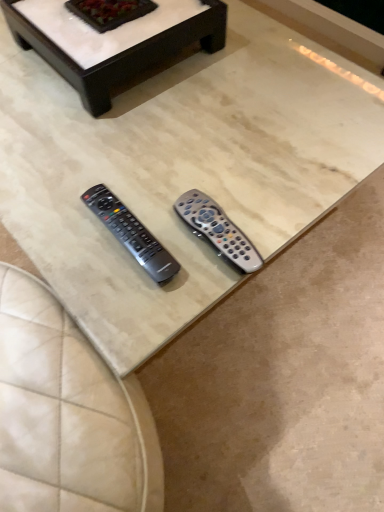
What do you see at coordinates (131, 234) in the screenshot? This screenshot has width=384, height=512. I see `silver metallic remote at center, which is counted as the first remote control, starting from the left` at bounding box center [131, 234].

What do you see at coordinates (179, 169) in the screenshot? The width and height of the screenshot is (384, 512). I see `beige marble coffee table at center, the first coffee table in the front-to-back sequence` at bounding box center [179, 169].

Where is `white marble coffee table at upper center, which ranks as the first coffee table in back-to-front order`? white marble coffee table at upper center, which ranks as the first coffee table in back-to-front order is located at coordinates (120, 51).

Considering the relative sizes of white marble coffee table at upper center, which appears as the second coffee table when viewed from the front, and silver metallic remote at center, which is counted as the first remote control, starting from the left, in the image provided, is white marble coffee table at upper center, which appears as the second coffee table when viewed from the front, bigger than silver metallic remote at center, which is counted as the first remote control, starting from the left,?

Correct, white marble coffee table at upper center, which appears as the second coffee table when viewed from the front, is larger in size than silver metallic remote at center, which is counted as the first remote control, starting from the left.

Does white marble coffee table at upper center, which appears as the second coffee table when viewed from the front, lie in front of silver metallic remote at center, which is counted as the first remote control, starting from the left?

No, the depth of white marble coffee table at upper center, which appears as the second coffee table when viewed from the front, is greater than that of silver metallic remote at center, which is counted as the first remote control, starting from the left.

From a real-world perspective, is white marble coffee table at upper center, which appears as the second coffee table when viewed from the front, above or below silver metallic remote at center, which ranks as the second remote control in right-to-left order?

Clearly, from a real-world perspective, white marble coffee table at upper center, which appears as the second coffee table when viewed from the front, is above silver metallic remote at center, which ranks as the second remote control in right-to-left order.

Is the position of translucent gray remote at center, arranged as the 1th remote control when viewed from the right, less distant than that of silver metallic remote at center, which ranks as the second remote control in right-to-left order?

That is False.

Is translucent gray remote at center, positioned as the 2th remote control in left-to-right order, not near silver metallic remote at center, which ranks as the second remote control in right-to-left order?

No, there isn't a large distance between translucent gray remote at center, positioned as the 2th remote control in left-to-right order, and silver metallic remote at center, which ranks as the second remote control in right-to-left order.

From a real-world perspective, which object rests below the other?

translucent gray remote at center, positioned as the 2th remote control in left-to-right order, is physically lower.

Is point (180, 83) positioned in front of point (163, 49)?

Yes, point (180, 83) is in front of point (163, 49).

Between beige marble coffee table at center, the first coffee table in the front-to-back sequence, and white marble coffee table at upper center, which ranks as the first coffee table in back-to-front order, which one has less height?

white marble coffee table at upper center, which ranks as the first coffee table in back-to-front order, is shorter.

Can you confirm if beige marble coffee table at center, the first coffee table in the front-to-back sequence, is thinner than white marble coffee table at upper center, which appears as the second coffee table when viewed from the front?

No, beige marble coffee table at center, the first coffee table in the front-to-back sequence, is not thinner than white marble coffee table at upper center, which appears as the second coffee table when viewed from the front.

How distant is beige marble coffee table at center, acting as the 2th coffee table starting from the back, from white marble coffee table at upper center, which ranks as the first coffee table in back-to-front order?

A distance of 7.04 inches exists between beige marble coffee table at center, acting as the 2th coffee table starting from the back, and white marble coffee table at upper center, which ranks as the first coffee table in back-to-front order.

Does translucent gray remote at center, positioned as the 2th remote control in left-to-right order, come behind white marble coffee table at upper center, which appears as the second coffee table when viewed from the front?

No, it is in front of white marble coffee table at upper center, which appears as the second coffee table when viewed from the front.

Measure the distance from translucent gray remote at center, positioned as the 2th remote control in left-to-right order, to white marble coffee table at upper center, which ranks as the first coffee table in back-to-front order.

They are 16.11 inches apart.

Which is farther from the camera, (249,246) or (81,89)?

The point (81,89) is farther.

Based on their positions, is translucent gray remote at center, arranged as the 1th remote control when viewed from the right, located to the left or right of white marble coffee table at upper center, which appears as the second coffee table when viewed from the front?

Clearly, translucent gray remote at center, arranged as the 1th remote control when viewed from the right, is on the right of white marble coffee table at upper center, which appears as the second coffee table when viewed from the front, in the image.

Is translucent gray remote at center, positioned as the 2th remote control in left-to-right order, not close to beige marble coffee table at center, the first coffee table in the front-to-back sequence?

No.

Does translucent gray remote at center, positioned as the 2th remote control in left-to-right order, have a greater width compared to beige marble coffee table at center, the first coffee table in the front-to-back sequence?

Incorrect, the width of translucent gray remote at center, positioned as the 2th remote control in left-to-right order, does not surpass that of beige marble coffee table at center, the first coffee table in the front-to-back sequence.

Is point (177, 205) closer or farther from the camera than point (52, 270)?

Point (177, 205) is positioned farther from the camera compared to point (52, 270).

Is translucent gray remote at center, positioned as the 2th remote control in left-to-right order, situated inside beige marble coffee table at center, the first coffee table in the front-to-back sequence, or outside?

translucent gray remote at center, positioned as the 2th remote control in left-to-right order, fits inside beige marble coffee table at center, the first coffee table in the front-to-back sequence.

Considering the relative sizes of white marble coffee table at upper center, which ranks as the first coffee table in back-to-front order, and beige marble coffee table at center, acting as the 2th coffee table starting from the back, in the image provided, is white marble coffee table at upper center, which ranks as the first coffee table in back-to-front order, thinner than beige marble coffee table at center, acting as the 2th coffee table starting from the back,?

Correct, the width of white marble coffee table at upper center, which ranks as the first coffee table in back-to-front order, is less than that of beige marble coffee table at center, acting as the 2th coffee table starting from the back.

The width and height of the screenshot is (384, 512). Find the location of `coffee table on the left of white marble coffee table at upper center, which ranks as the first coffee table in back-to-front order`. coffee table on the left of white marble coffee table at upper center, which ranks as the first coffee table in back-to-front order is located at coordinates (179, 169).

Which is in front, white marble coffee table at upper center, which appears as the second coffee table when viewed from the front, or beige marble coffee table at center, acting as the 2th coffee table starting from the back?

beige marble coffee table at center, acting as the 2th coffee table starting from the back, is closer to the camera.

Is point (70, 59) closer to camera compared to point (316, 197)?

No, it is behind (316, 197).

Would you say silver metallic remote at center, which ranks as the second remote control in right-to-left order, is inside or outside translucent gray remote at center, arranged as the 1th remote control when viewed from the right?

silver metallic remote at center, which ranks as the second remote control in right-to-left order, is spatially situated outside translucent gray remote at center, arranged as the 1th remote control when viewed from the right.

Who is bigger, silver metallic remote at center, which is counted as the first remote control, starting from the left, or translucent gray remote at center, arranged as the 1th remote control when viewed from the right?

Bigger between the two is translucent gray remote at center, arranged as the 1th remote control when viewed from the right.

Is silver metallic remote at center, which ranks as the second remote control in right-to-left order, turned away from translucent gray remote at center, arranged as the 1th remote control when viewed from the right?

Yes, silver metallic remote at center, which ranks as the second remote control in right-to-left order, is facing away from translucent gray remote at center, arranged as the 1th remote control when viewed from the right.

Does silver metallic remote at center, which ranks as the second remote control in right-to-left order, have a greater height compared to translucent gray remote at center, positioned as the 2th remote control in left-to-right order?

In fact, silver metallic remote at center, which ranks as the second remote control in right-to-left order, may be shorter than translucent gray remote at center, positioned as the 2th remote control in left-to-right order.

Locate an element on the screen. the 2nd remote control in front of the white marble coffee table at upper center, which ranks as the first coffee table in back-to-front order is located at coordinates (131, 234).

Locate an element on the screen. The height and width of the screenshot is (512, 384). remote control behind the silver metallic remote at center, which ranks as the second remote control in right-to-left order is located at coordinates (218, 230).

Looking at the image, which one is located closer to translucent gray remote at center, positioned as the 2th remote control in left-to-right order, white marble coffee table at upper center, which ranks as the first coffee table in back-to-front order, or silver metallic remote at center, which ranks as the second remote control in right-to-left order?

Among the two, silver metallic remote at center, which ranks as the second remote control in right-to-left order, is located nearer to translucent gray remote at center, positioned as the 2th remote control in left-to-right order.

From the image, which object appears to be farther from silver metallic remote at center, which is counted as the first remote control, starting from the left, beige marble coffee table at center, the first coffee table in the front-to-back sequence, or white marble coffee table at upper center, which ranks as the first coffee table in back-to-front order?

white marble coffee table at upper center, which ranks as the first coffee table in back-to-front order, is further to silver metallic remote at center, which is counted as the first remote control, starting from the left.

Considering their positions, is translucent gray remote at center, arranged as the 1th remote control when viewed from the right, positioned closer to silver metallic remote at center, which ranks as the second remote control in right-to-left order, than white marble coffee table at upper center, which appears as the second coffee table when viewed from the front?

The object closer to silver metallic remote at center, which ranks as the second remote control in right-to-left order, is translucent gray remote at center, arranged as the 1th remote control when viewed from the right.

Looking at the image, which one is located further to beige marble coffee table at center, acting as the 2th coffee table starting from the back, translucent gray remote at center, arranged as the 1th remote control when viewed from the right, or silver metallic remote at center, which ranks as the second remote control in right-to-left order?

Among the two, silver metallic remote at center, which ranks as the second remote control in right-to-left order, is located further to beige marble coffee table at center, acting as the 2th coffee table starting from the back.

Considering their positions, is silver metallic remote at center, which ranks as the second remote control in right-to-left order, positioned further to translucent gray remote at center, positioned as the 2th remote control in left-to-right order, than white marble coffee table at upper center, which ranks as the first coffee table in back-to-front order?

white marble coffee table at upper center, which ranks as the first coffee table in back-to-front order, is positioned further to the anchor translucent gray remote at center, positioned as the 2th remote control in left-to-right order.

Which object lies nearer to the anchor point beige marble coffee table at center, acting as the 2th coffee table starting from the back, silver metallic remote at center, which ranks as the second remote control in right-to-left order, or translucent gray remote at center, arranged as the 1th remote control when viewed from the right?

translucent gray remote at center, arranged as the 1th remote control when viewed from the right.

Estimate the real-world distances between objects in this image. Which object is further from white marble coffee table at upper center, which ranks as the first coffee table in back-to-front order, translucent gray remote at center, arranged as the 1th remote control when viewed from the right, or beige marble coffee table at center, the first coffee table in the front-to-back sequence?

translucent gray remote at center, arranged as the 1th remote control when viewed from the right, is further to white marble coffee table at upper center, which ranks as the first coffee table in back-to-front order.

Based on their spatial positions, is white marble coffee table at upper center, which ranks as the first coffee table in back-to-front order, or translucent gray remote at center, positioned as the 2th remote control in left-to-right order, further from silver metallic remote at center, which ranks as the second remote control in right-to-left order?

Based on the image, white marble coffee table at upper center, which ranks as the first coffee table in back-to-front order, appears to be further to silver metallic remote at center, which ranks as the second remote control in right-to-left order.

The width and height of the screenshot is (384, 512). What are the coordinates of `remote control between beige marble coffee table at center, acting as the 2th coffee table starting from the back, and silver metallic remote at center, which is counted as the first remote control, starting from the left, vertically` in the screenshot? It's located at (218, 230).

The image size is (384, 512). I want to click on coffee table between white marble coffee table at upper center, which ranks as the first coffee table in back-to-front order, and translucent gray remote at center, arranged as the 1th remote control when viewed from the right, vertically, so click(179, 169).

Image resolution: width=384 pixels, height=512 pixels. Identify the location of remote control between white marble coffee table at upper center, which ranks as the first coffee table in back-to-front order, and silver metallic remote at center, which is counted as the first remote control, starting from the left, vertically. (218, 230).

This screenshot has height=512, width=384. I want to click on coffee table that lies between white marble coffee table at upper center, which ranks as the first coffee table in back-to-front order, and silver metallic remote at center, which is counted as the first remote control, starting from the left, from top to bottom, so click(179, 169).